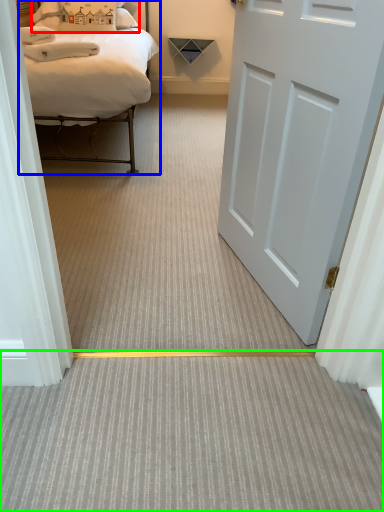
Question: Which object is the closest to the pillow (highlighted by a red box)? Choose among these: bed (highlighted by a blue box) or plain (highlighted by a green box).

Choices:
 (A) bed
 (B) plain

Answer: (A)